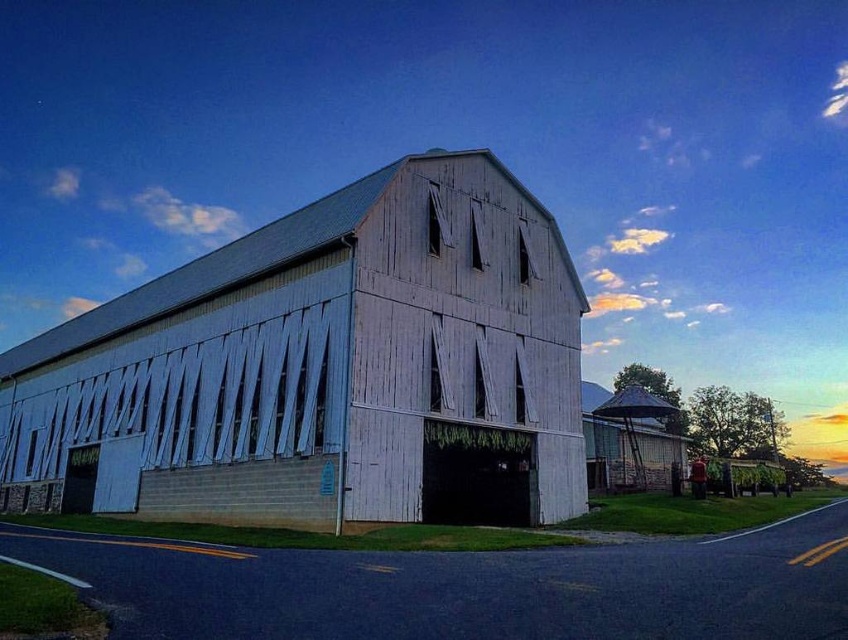
Is white wood barn at center shorter than rustic wood silo at right?

Incorrect, white wood barn at center's height does not fall short of rustic wood silo at right's.

Who is more forward, (377, 321) or (612, 428)?

Point (377, 321) is in front.

Where is `white wood barn at center`? The height and width of the screenshot is (640, 848). white wood barn at center is located at coordinates (324, 368).